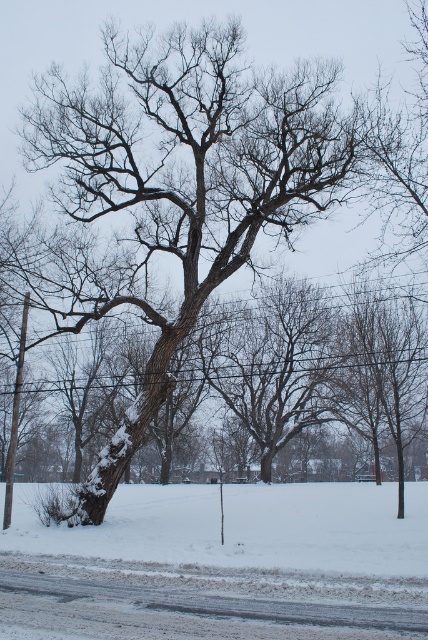
Question: Considering the relative positions of snow-covered bark tree at center and white powdery snow at center in the image provided, where is snow-covered bark tree at center located with respect to white powdery snow at center?

Choices:
 (A) above
 (B) below

Answer: (A)

Question: Observing the image, what is the correct spatial positioning of snow-covered bark tree at center in reference to white powdery snow at center?

Choices:
 (A) left
 (B) right

Answer: (A)

Question: Among these points, which one is farthest from the camera?

Choices:
 (A) (395, 573)
 (B) (332, 141)

Answer: (B)

Question: Does snow-covered bark tree at center lie behind white powdery snow at center?

Choices:
 (A) yes
 (B) no

Answer: (A)